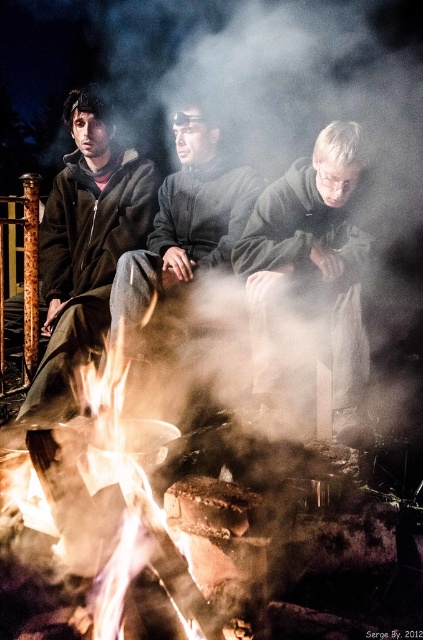
Question: Which point is closer to the camera taking this photo?

Choices:
 (A) (137, 204)
 (B) (288, 243)

Answer: (B)

Question: Can you confirm if matte black jacket at left is thinner than dark gray fleece jacket at center?

Choices:
 (A) yes
 (B) no

Answer: (B)

Question: Which object appears farthest from the camera in this image?

Choices:
 (A) dark gray fleece jacket at center
 (B) dark gray woolen sweater at center

Answer: (B)

Question: Where is dark gray fleece jacket at center located in relation to dark gray woolen sweater at center in the image?

Choices:
 (A) below
 (B) above

Answer: (A)

Question: Considering the relative positions of matte black jacket at left and dark gray woolen sweater at center in the image provided, where is matte black jacket at left located with respect to dark gray woolen sweater at center?

Choices:
 (A) left
 (B) right

Answer: (A)

Question: Which object is farther from the camera taking this photo?

Choices:
 (A) matte black jacket at left
 (B) dark gray fleece jacket at center

Answer: (A)